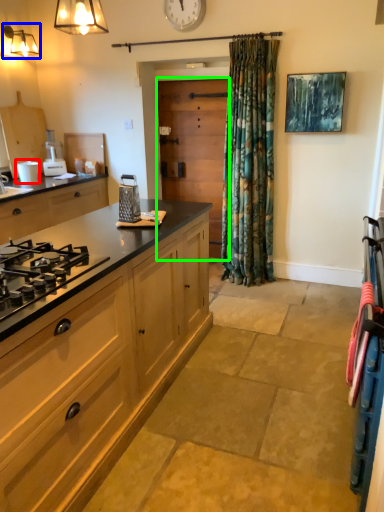
Question: Based on their relative distances, which object is farther from appliance (highlighted by a red box)? Choose from light fixture (highlighted by a blue box) and screen door (highlighted by a green box).

Choices:
 (A) light fixture
 (B) screen door

Answer: (B)